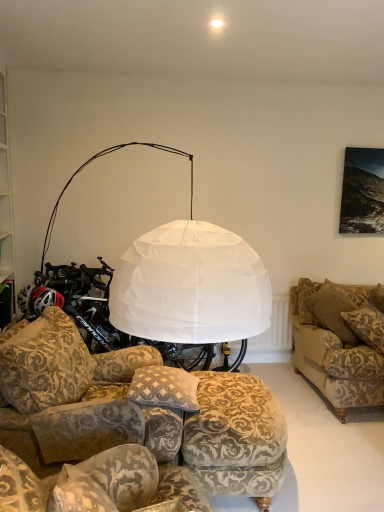
Question: Would you say patterned fabric ottoman at lower center, which is the first studio couch in front-to-back order, is inside or outside plush beige pillow at lower center?

Choices:
 (A) outside
 (B) inside

Answer: (A)

Question: Based on their positions, is patterned fabric ottoman at lower center, the second studio couch from the right, located to the left or right of plush beige pillow at lower center?

Choices:
 (A) right
 (B) left

Answer: (B)

Question: Estimate the real-world distances between objects in this image. Which object is closer to the plush beige pillow at lower center?

Choices:
 (A) white paper lampshade at upper center
 (B) patterned fabric ottoman at lower center, which is the first studio couch in front-to-back order
 (C) patterned fabric footrest at lower center
 (D) velvet-patterned couch at right, the 3th studio couch when ordered from front to back
 (E) patterned fabric couch at lower left, which is the first studio couch in left-to-right order

Answer: (C)

Question: Based on their relative distances, which object is nearer to the velvet-patterned couch at right, the 1th studio couch positioned from the back?

Choices:
 (A) patterned fabric couch at lower left, the 2th studio couch when ordered from back to front
 (B) white paper lampshade at upper center
 (C) patterned fabric ottoman at lower center, the second studio couch from the right
 (D) patterned fabric footrest at lower center
 (E) plush beige pillow at lower center

Answer: (D)